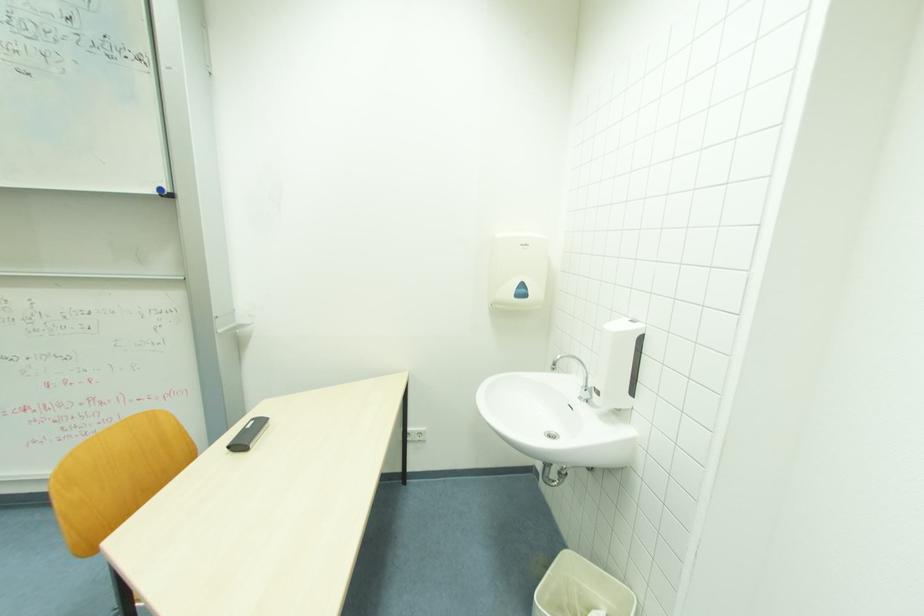
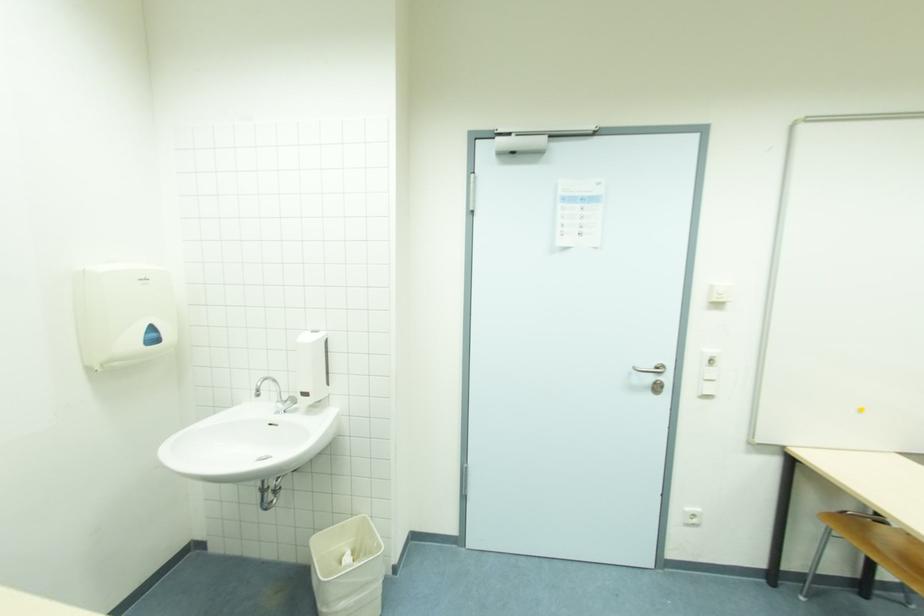
Question: Based on the continuous images, in which direction is the camera rotating? Reply with the corresponding letter.

Choices:
 (A) Left
 (B) Right
 (C) Up
 (D) Down

Answer: (B)